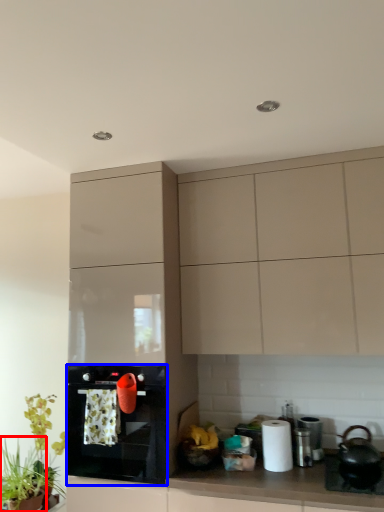
Question: Which of the following is the farthest to the observer, plant (highlighted by a red box) or kitchen appliance (highlighted by a blue box)?

Choices:
 (A) plant
 (B) kitchen appliance

Answer: (A)